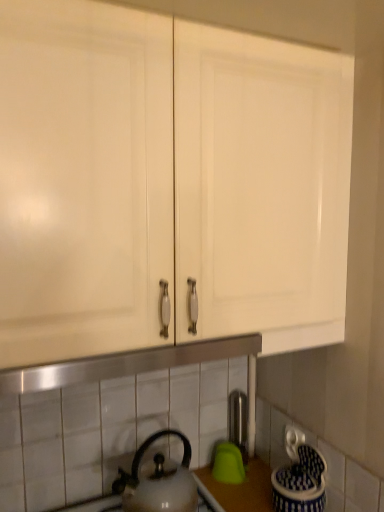
The width and height of the screenshot is (384, 512). Describe the element at coordinates (165, 181) in the screenshot. I see `white glossy cabinet doors at upper center` at that location.

Describe the element at coordinates (238, 421) in the screenshot. I see `satin nickel faucet at center` at that location.

The image size is (384, 512). In order to click on satin nickel faucet at center in this screenshot , I will do `click(238, 421)`.

Where is `white glossy kettle at lower center`? white glossy kettle at lower center is located at coordinates (158, 481).

In terms of size, does white glossy kettle at lower center appear bigger or smaller than satin nickel faucet at center?

Clearly, white glossy kettle at lower center is larger in size than satin nickel faucet at center.

What's the angular difference between white glossy kettle at lower center and satin nickel faucet at center's facing directions?

They differ by 2.34 degrees in their facing directions.

Between point (149, 482) and point (244, 458), which one is positioned in front?

The point (149, 482) is in front.

From the image's perspective, who appears lower, white glossy kettle at lower center or satin nickel faucet at center?

From the image's view, white glossy kettle at lower center is below.

Which of these two, white glossy cabinet doors at upper center or white glossy kettle at lower center, stands taller?

white glossy cabinet doors at upper center is taller.

From a real-world perspective, is white glossy cabinet doors at upper center physically located above or below white glossy kettle at lower center?

white glossy cabinet doors at upper center is situated higher than white glossy kettle at lower center in the real world.

Which point is more forward, (77, 176) or (115, 493)?

The point (77, 176) is closer to the camera.

From the image's perspective, which is below, white glossy cabinet doors at upper center or white glossy kettle at lower center?

white glossy kettle at lower center.

Can you confirm if white glossy kettle at lower center is positioned to the right of white glossy cabinet doors at upper center?

In fact, white glossy kettle at lower center is to the left of white glossy cabinet doors at upper center.

From a real-world perspective, is white glossy kettle at lower center positioned over white glossy cabinet doors at upper center based on gravity?

No, from a real-world perspective, white glossy kettle at lower center is not over white glossy cabinet doors at upper center

How many degrees apart are the facing directions of white glossy kettle at lower center and white glossy cabinet doors at upper center?

There is a 4e-05-degree angle between the facing directions of white glossy kettle at lower center and white glossy cabinet doors at upper center.

Which point is more distant from viewer, [181,494] or [109,173]?

The point [181,494] is more distant.

Which of these two, white glossy cabinet doors at upper center or satin nickel faucet at center, is thinner?

satin nickel faucet at center is thinner.

From the image's perspective, which is above, white glossy cabinet doors at upper center or satin nickel faucet at center?

white glossy cabinet doors at upper center, from the image's perspective.

Does white glossy cabinet doors at upper center contain satin nickel faucet at center?

No, satin nickel faucet at center is not surrounded by white glossy cabinet doors at upper center.

Is white glossy cabinet doors at upper center placed right next to satin nickel faucet at center?

No.

Find the location of a particular element. faucet above the white glossy kettle at lower center (from the image's perspective) is located at coordinates (238, 421).

Is satin nickel faucet at center directly adjacent to white glossy kettle at lower center?

No.

Which is less distant, (234, 424) or (137, 482)?

Point (137, 482)

Based on the photo, could you tell me if satin nickel faucet at center is turned towards white glossy kettle at lower center?

No, satin nickel faucet at center does not turn towards white glossy kettle at lower center.

From the image's perspective, is satin nickel faucet at center over white glossy cabinet doors at upper center?

No, from the image's perspective, satin nickel faucet at center is not above white glossy cabinet doors at upper center.

From a real-world perspective, is satin nickel faucet at center above or below white glossy cabinet doors at upper center?

satin nickel faucet at center is below white glossy cabinet doors at upper center.

Considering the positions of objects satin nickel faucet at center and white glossy cabinet doors at upper center in the image provided, who is in front, satin nickel faucet at center or white glossy cabinet doors at upper center?

white glossy cabinet doors at upper center is more forward.

The width and height of the screenshot is (384, 512). I want to click on kettle below the satin nickel faucet at center (from the image's perspective), so click(158, 481).

Where is `cabinetry in front of the white glossy kettle at lower center`? cabinetry in front of the white glossy kettle at lower center is located at coordinates click(x=165, y=181).

Looking at the image, which one is located further to satin nickel faucet at center, white glossy cabinet doors at upper center or white glossy kettle at lower center?

white glossy cabinet doors at upper center is further to satin nickel faucet at center.

Estimate the real-world distances between objects in this image. Which object is closer to satin nickel faucet at center, white glossy kettle at lower center or white glossy cabinet doors at upper center?

white glossy kettle at lower center is positioned closer to the anchor satin nickel faucet at center.

Estimate the real-world distances between objects in this image. Which object is closer to white glossy cabinet doors at upper center, white glossy kettle at lower center or satin nickel faucet at center?

white glossy kettle at lower center is closer to white glossy cabinet doors at upper center.

Estimate the real-world distances between objects in this image. Which object is further from white glossy kettle at lower center, white glossy cabinet doors at upper center or satin nickel faucet at center?

white glossy cabinet doors at upper center is positioned further to the anchor white glossy kettle at lower center.

From the image, which object appears to be nearer to white glossy cabinet doors at upper center, satin nickel faucet at center or white glossy kettle at lower center?

The object closer to white glossy cabinet doors at upper center is white glossy kettle at lower center.

Looking at the image, which one is located further to white glossy kettle at lower center, satin nickel faucet at center or white glossy cabinet doors at upper center?

Among the two, white glossy cabinet doors at upper center is located further to white glossy kettle at lower center.

Locate an element on the screen. This screenshot has height=512, width=384. faucet between white glossy cabinet doors at upper center and white glossy kettle at lower center from top to bottom is located at coordinates (238, 421).